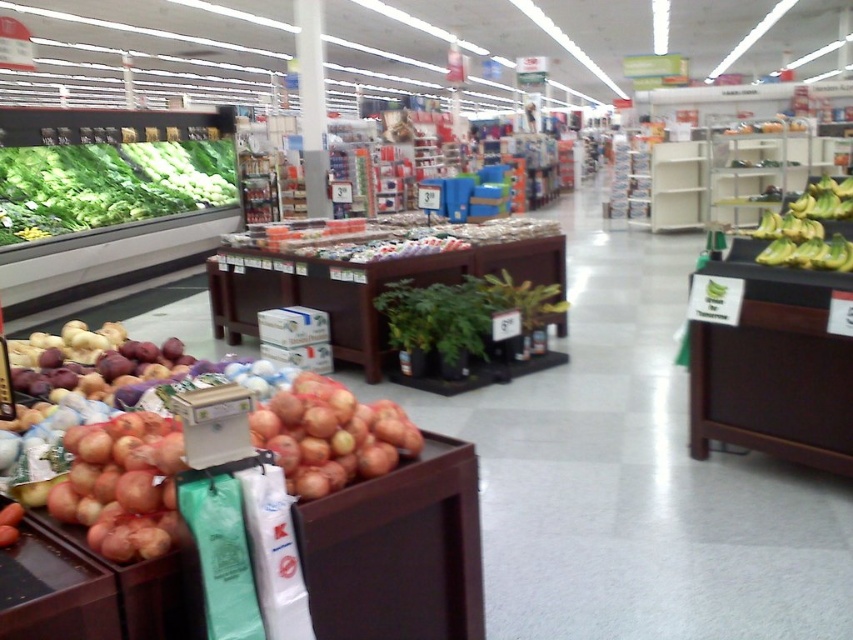
Based on the photo, measure the distance from green leafy vegetables at left to rustic brown onions at center.

green leafy vegetables at left is 7.11 meters from rustic brown onions at center.

Which is behind, point (86, 180) or point (277, 451)?

Positioned behind is point (86, 180).

Where is `green leafy vegetables at left`? Image resolution: width=853 pixels, height=640 pixels. green leafy vegetables at left is located at coordinates (108, 184).

Which of these two, smooth red onion at lower left or yellow smooth bananas at right, stands shorter?

With less height is smooth red onion at lower left.

Is smooth red onion at lower left positioned in front of yellow smooth bananas at right?

That is True.

The image size is (853, 640). I want to click on smooth red onion at lower left, so click(x=318, y=428).

Identify the location of smooth red onion at lower left. The width and height of the screenshot is (853, 640). (318, 428).

Who is positioned more to the right, green leafy vegetables at left or ripe red onions at lower left?

Positioned to the right is ripe red onions at lower left.

Does green leafy vegetables at left appear under ripe red onions at lower left?

No, green leafy vegetables at left is not below ripe red onions at lower left.

Identify the location of green leafy vegetables at left. The height and width of the screenshot is (640, 853). (108, 184).